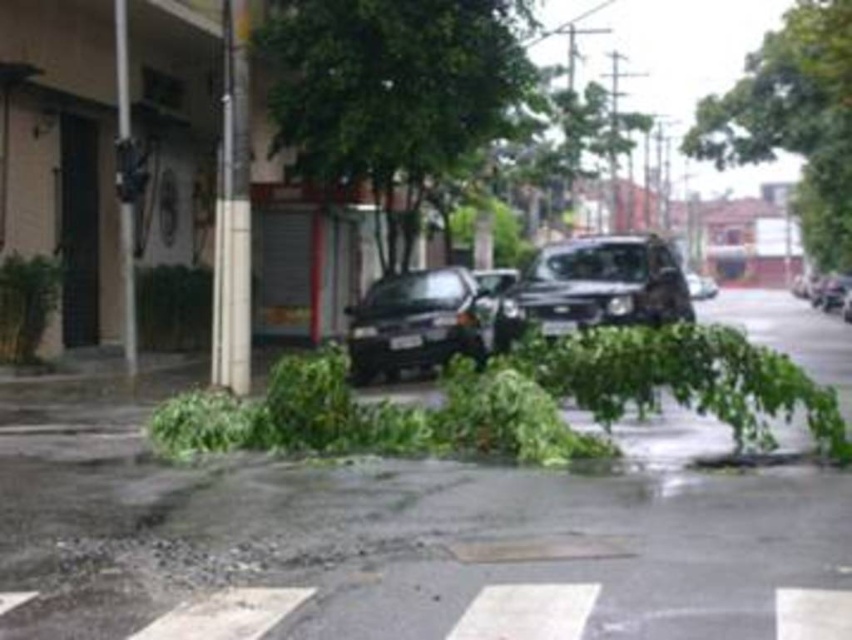
You are a delivery driver who needs to park your car in this area. The parking spot you want is located at coordinates 0.45, 0.7. Is the satin black suv at center blocking your desired parking spot?

The satin black suv at center is located at point [594,285], which is very close to the desired parking spot at [596,288]. The slight difference in coordinates suggests it might be occupying or very near the spot, so it is likely blocking access.

Looking at this image, you are a delivery driver who needs to drive a 15.34 meter long truck from the shiny black car at right to the green leafy tree at center. Is there enough space for the truck to maneuver between them?

The distance between the green leafy tree at center and the shiny black car at right is 46.86 meters, which is greater than the truck length of 15.34 meters. Therefore, the truck can maneuver between them.